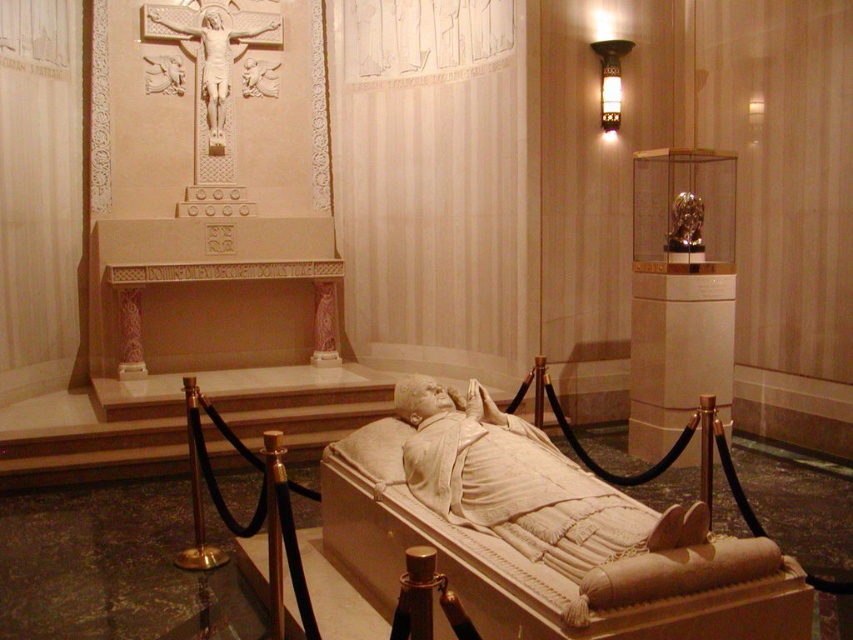
Question: Is white marble statue at center bigger than white marble crucifix at upper center?

Choices:
 (A) yes
 (B) no

Answer: (A)

Question: Which object is positioned farthest from the white marble statue at center?

Choices:
 (A) white marble crucifix at upper center
 (B) gold metallic statue at upper right

Answer: (A)

Question: Can you confirm if white marble crucifix at upper center is smaller than gold metallic statue at upper right?

Choices:
 (A) no
 (B) yes

Answer: (A)

Question: Which point is closer to the camera?

Choices:
 (A) white marble statue at center
 (B) gold metallic statue at upper right
 (C) white marble crucifix at upper center

Answer: (A)

Question: Which point is closer to the camera taking this photo?

Choices:
 (A) (178, 29)
 (B) (688, 205)
 (C) (693, 554)

Answer: (C)

Question: Can you confirm if white marble crucifix at upper center is positioned above gold metallic statue at upper right?

Choices:
 (A) no
 (B) yes

Answer: (B)